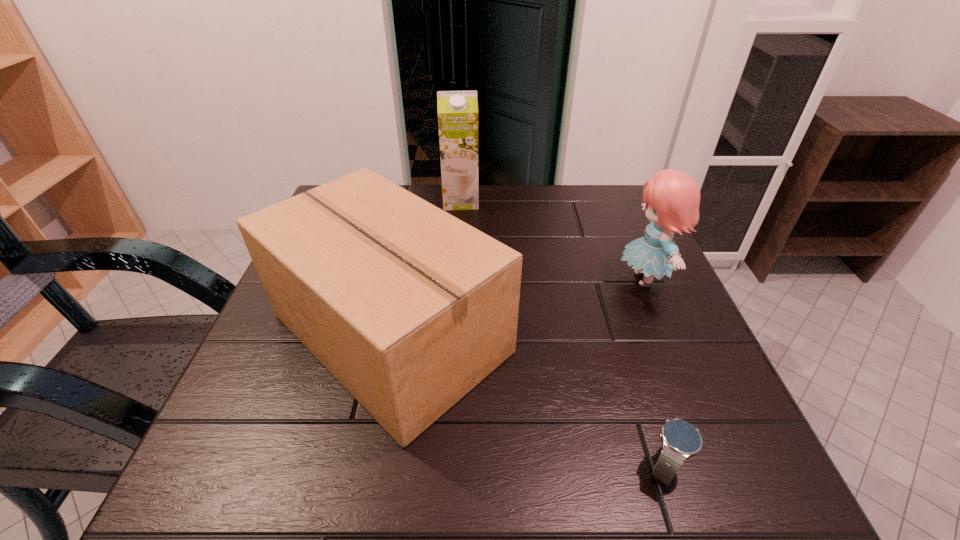
This screenshot has height=540, width=960. Find the location of `object that is the third closest to the shortest object`. object that is the third closest to the shortest object is located at coordinates (457, 111).

Locate which object ranks second in proximity to the box. Please provide its 2D coordinates. Your answer should be formatted as a tuple, i.e. [(x, y)], where the tuple contains the x and y coordinates of a point satisfying the conditions above.

[(457, 111)]